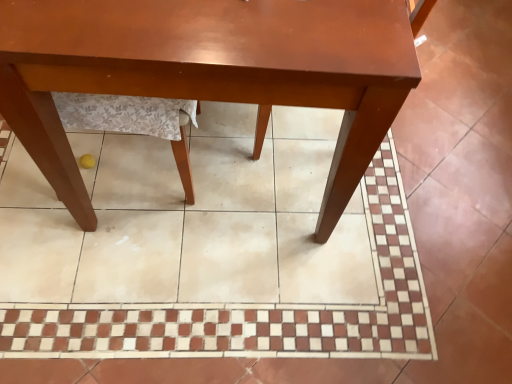
In order to click on spots to the right of matte wood table at center in this screenshot , I will do `click(442, 153)`.